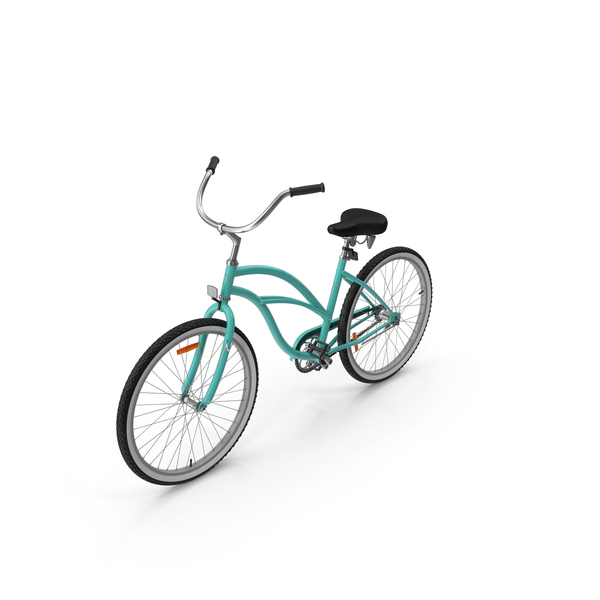
Find the location of a particular element. This screenshot has height=600, width=600. handle is located at coordinates (216, 161).